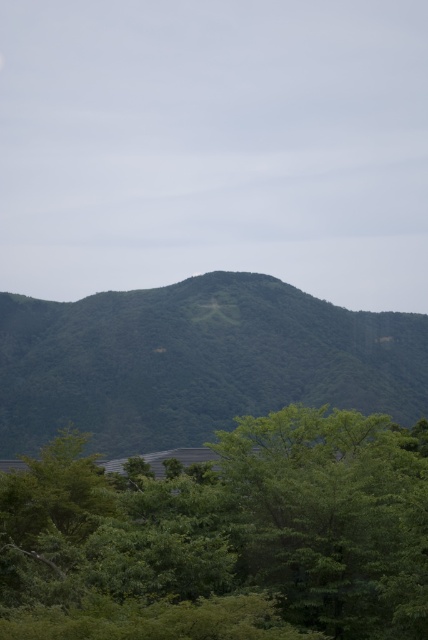
Between point (386, 608) and point (149, 413), which one is positioned behind?

The point (149, 413) is behind.

The width and height of the screenshot is (428, 640). In order to click on green leafy tree at lower center in this screenshot , I will do `click(225, 536)`.

Describe the element at coordinates (225, 536) in the screenshot. The image size is (428, 640). I see `green leafy tree at lower center` at that location.

Locate an element on the screen. The width and height of the screenshot is (428, 640). green leafy tree at lower center is located at coordinates (225, 536).